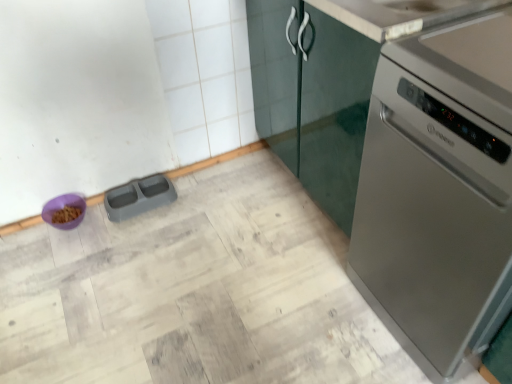
Question: Is gray plastic pet feeder at lower left, the 2th appliance in the left-to-right sequence, to the left or to the right of satin silver dishwasher at right in the image?

Choices:
 (A) right
 (B) left

Answer: (B)

Question: Looking at their shapes, would you say gray plastic pet feeder at lower left, which is the 1th appliance from right to left, is wider or thinner than satin silver dishwasher at right?

Choices:
 (A) thin
 (B) wide

Answer: (A)

Question: Based on their relative distances, which object is nearer to the gray plastic pet feeder at lower left, which is the 1th appliance from right to left?

Choices:
 (A) satin silver dishwasher at right
 (B) purple plastic bowl at lower left, the 2th appliance viewed from the right

Answer: (B)

Question: Estimate the real-world distances between objects in this image. Which object is farther from the gray plastic pet feeder at lower left, which is the 1th appliance from right to left?

Choices:
 (A) satin silver dishwasher at right
 (B) purple plastic bowl at lower left, the 2th appliance viewed from the right

Answer: (A)